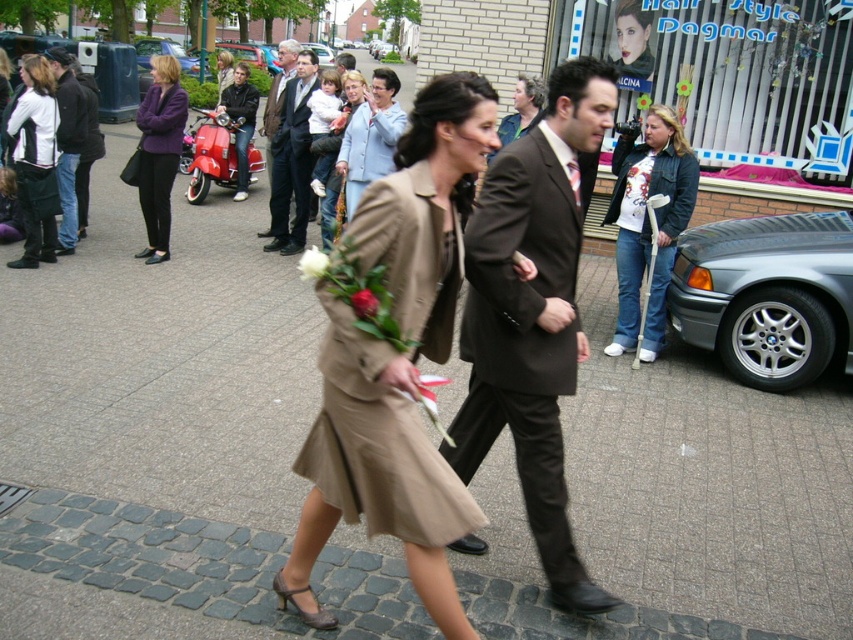
Based on the photo, you are a photographer standing in the middle of the street. You want to take a photo of the matte brown suit at center and the matte black scooter at center. Which object should you focus on first to ensure both are in sharp focus?

You should focus on the matte brown suit at center first because it is closer to the viewer than the matte black scooter at center, so adjusting focus from near to far will help both be in sharp focus.

In the scene shown: You are a delivery person who needs to pass through the crowd in the street scene. You have a matte black scooter at center and a smooth pink rose at center in your path. Which object should you avoid to navigate safely?

The matte black scooter at center might be wider than the smooth pink rose at center, so you should avoid the matte black scooter at center to navigate safely.